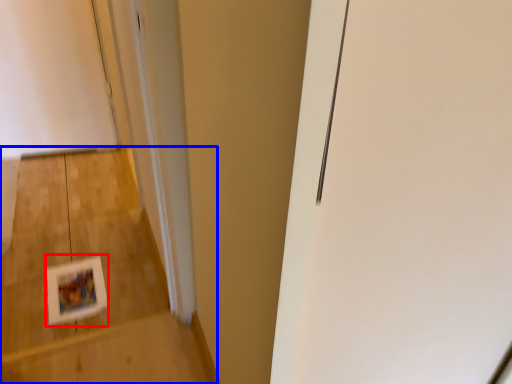
Question: Which object is closer to the camera taking this photo, postcard (highlighted by a red box) or stairwell (highlighted by a blue box)?

Choices:
 (A) postcard
 (B) stairwell

Answer: (B)